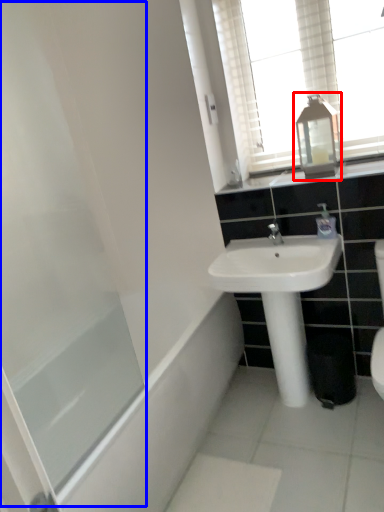
Question: Among these objects, which one is nearest to the camera, medicine cabinet (highlighted by a red box) or screen door (highlighted by a blue box)?

Choices:
 (A) medicine cabinet
 (B) screen door

Answer: (B)